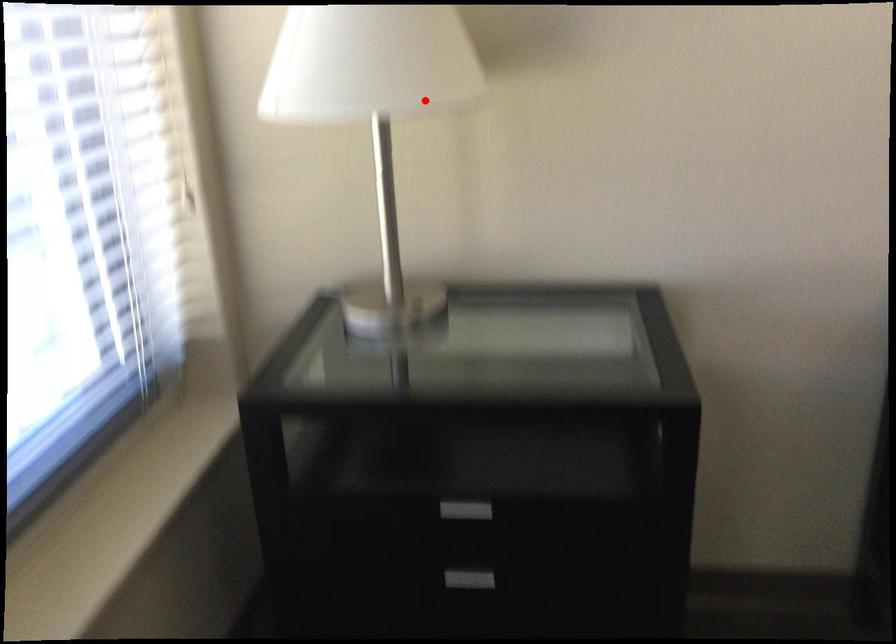
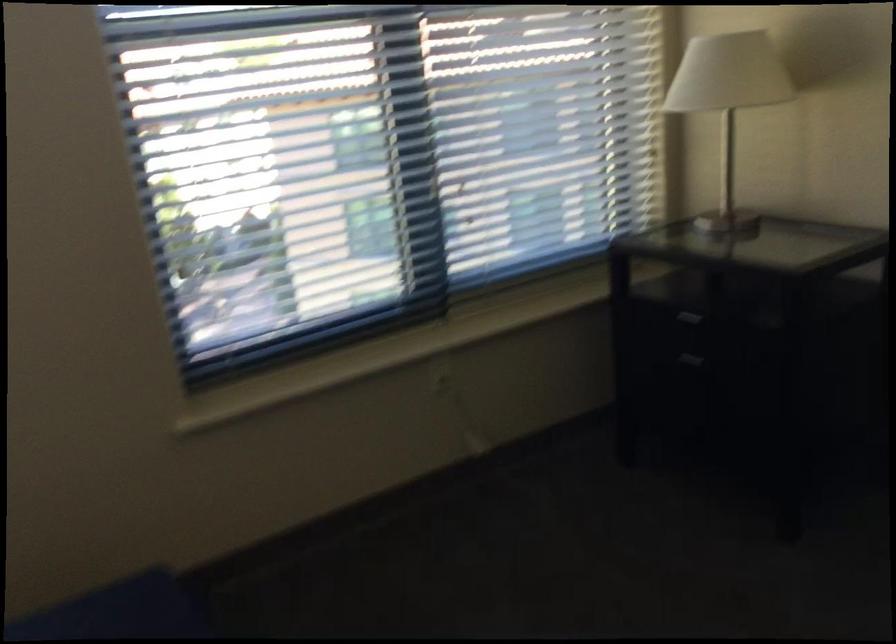
Where in the second image is the point corresponding to the highlighted location from the first image?

(728, 102)